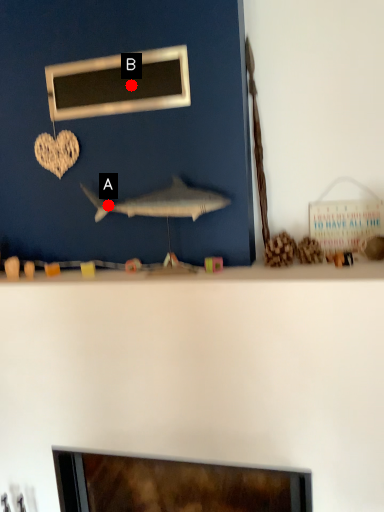
Question: Two points are circled on the image, labeled by A and B beside each circle. Which point is further to the camera?

Choices:
 (A) A is further
 (B) B is further

Answer: (A)